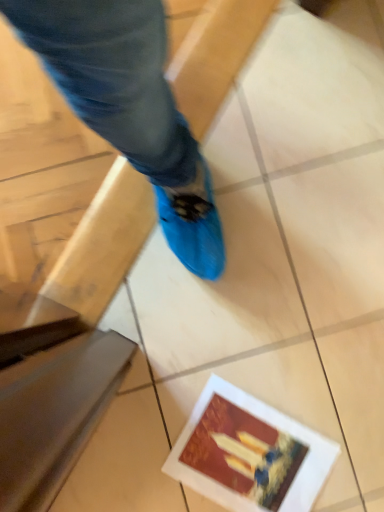
At what (x,y) coordinates should I click in order to perform the action: click on free point above matte paper postcard at lower right (from a real-world perspective). Please return your answer as a coordinate pair (x, y). The image size is (384, 512). Looking at the image, I should click on (254, 464).